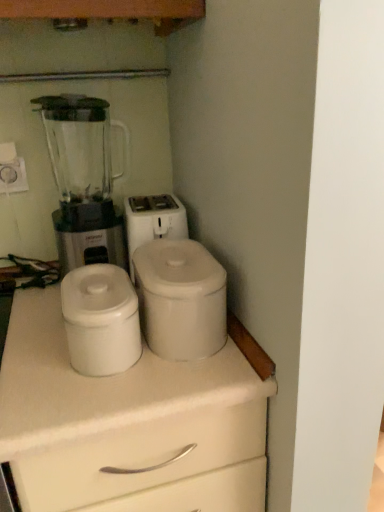
Locate an element on the screen. This screenshot has width=384, height=512. free space in front of white matte canister at center, arranged as the 1th appliance when viewed from the right is located at coordinates (159, 382).